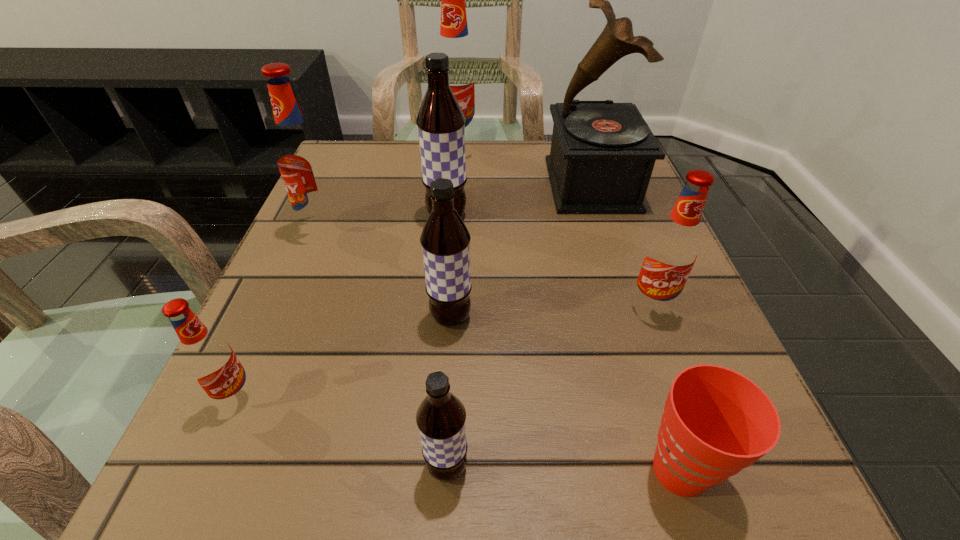
Image resolution: width=960 pixels, height=540 pixels. I want to click on free space located on the left of the second farthest brown root beer, so click(332, 317).

The height and width of the screenshot is (540, 960). In order to click on vacant space located 0.190m on the back of the seventh farthest object in this screenshot , I will do pos(287,284).

At what (x,y) coordinates should I click in order to perform the action: click on vacant region located 0.090m on the back of the nearest brown root beer. Please return your answer as a coordinate pair (x, y). Looking at the image, I should click on (451, 382).

The height and width of the screenshot is (540, 960). Find the location of `vacant space located on the back of the shortest object`. vacant space located on the back of the shortest object is located at coordinates (621, 288).

At what (x,y) coordinates should I click in order to perform the action: click on root beer that is positioned at the far edge. Please return your answer as a coordinate pair (x, y). Image resolution: width=960 pixels, height=540 pixels. Looking at the image, I should click on (454, 40).

The image size is (960, 540). I want to click on phonograph_record situated at the far edge, so click(602, 155).

Locate an element on the screen. The height and width of the screenshot is (540, 960). root beer present at the near edge is located at coordinates (441, 416).

At what (x,y) coordinates should I click in order to perform the action: click on cup located in the near edge section of the desktop. Please return your answer as a coordinate pair (x, y). Looking at the image, I should click on (716, 422).

Locate an element on the screen. phonograph_record at the right edge is located at coordinates (602, 155).

Locate an element on the screen. root beer situated at the right edge is located at coordinates (672, 251).